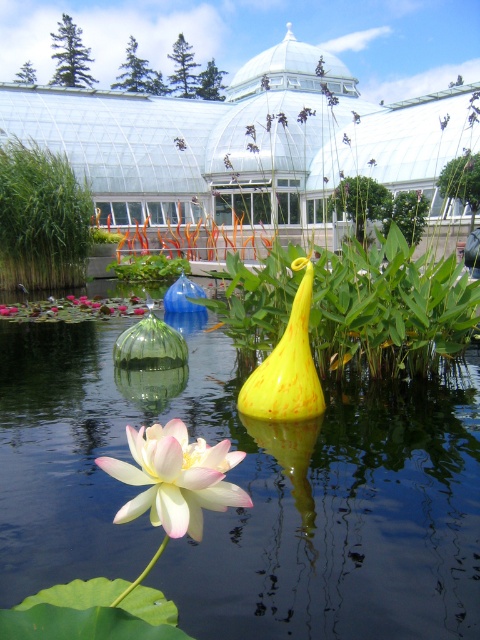
Question: Can you confirm if transparent glass water at center is bigger than soft pink petal at center?

Choices:
 (A) yes
 (B) no

Answer: (A)

Question: From the image, what is the correct spatial relationship of green grass at left in relation to yellow matte vase at center?

Choices:
 (A) right
 (B) left

Answer: (B)

Question: Which of the following is the closest to the observer?

Choices:
 (A) yellow matte vase at center
 (B) soft pink petal at center
 (C) green grass at left
 (D) transparent glass water at center

Answer: (B)

Question: Which is nearer to the transparent glass water at center?

Choices:
 (A) yellow matte vase at center
 (B) soft pink petal at center
 (C) green grass at left

Answer: (A)

Question: Based on their relative distances, which object is nearer to the green grass at left?

Choices:
 (A) yellow matte vase at center
 (B) transparent glass water at center

Answer: (B)

Question: From the image, what is the correct spatial relationship of soft pink petal at center in relation to yellow matte vase at center?

Choices:
 (A) right
 (B) left

Answer: (B)